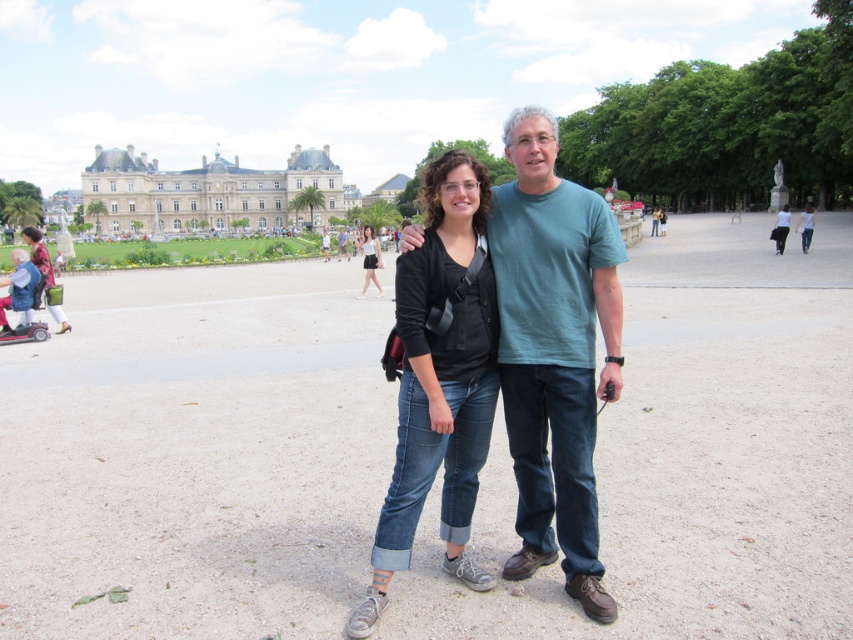
Question: Does denim jeans at center appear over matte black top at center?

Choices:
 (A) no
 (B) yes

Answer: (A)

Question: Among these points, which one is farthest from the camera?

Choices:
 (A) pos(573,499)
 (B) pos(407,352)
 (C) pos(376,244)
 (D) pos(299,170)

Answer: (D)

Question: Which object is closer to the camera taking this photo?

Choices:
 (A) denim jeans at center
 (B) beige stone palace at upper left
 (C) matte black top at center

Answer: (A)

Question: Does teal cotton t-shirt at center have a greater width compared to denim jeans at center?

Choices:
 (A) yes
 (B) no

Answer: (A)

Question: Which object is positioned farthest from the teal cotton t-shirt at center?

Choices:
 (A) matte black top at center
 (B) denim jeans at center

Answer: (A)

Question: Can you confirm if denim jeans at center is smaller than matte black top at center?

Choices:
 (A) yes
 (B) no

Answer: (B)